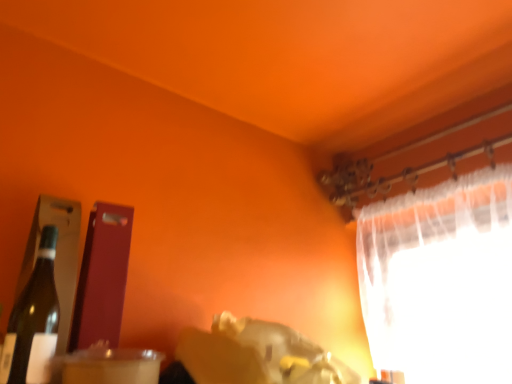
Question: Is clear plastic straw at lower left to the left of matte glass bottle at left from the viewer's perspective?

Choices:
 (A) yes
 (B) no

Answer: (B)

Question: Is clear plastic straw at lower left to the right of matte glass bottle at left from the viewer's perspective?

Choices:
 (A) no
 (B) yes

Answer: (B)

Question: Is matte glass bottle at left inside clear plastic straw at lower left?

Choices:
 (A) yes
 (B) no

Answer: (B)

Question: From the image's perspective, is clear plastic straw at lower left located above matte glass bottle at left?

Choices:
 (A) yes
 (B) no

Answer: (B)

Question: Is clear plastic straw at lower left bigger than matte glass bottle at left?

Choices:
 (A) yes
 (B) no

Answer: (B)

Question: In the image, is white sheer curtain at upper right on the left side or the right side of matte glass bottle at left?

Choices:
 (A) right
 (B) left

Answer: (A)

Question: In terms of size, does white sheer curtain at upper right appear bigger or smaller than matte glass bottle at left?

Choices:
 (A) big
 (B) small

Answer: (A)

Question: From the image's perspective, is white sheer curtain at upper right above or below matte glass bottle at left?

Choices:
 (A) below
 (B) above

Answer: (A)

Question: Is white sheer curtain at upper right taller or shorter than matte glass bottle at left?

Choices:
 (A) tall
 (B) short

Answer: (A)

Question: Which is correct: clear plastic straw at lower left is inside matte glass bottle at left, or outside of it?

Choices:
 (A) inside
 (B) outside

Answer: (B)

Question: From the image's perspective, is clear plastic straw at lower left above or below matte glass bottle at left?

Choices:
 (A) above
 (B) below

Answer: (B)

Question: Is point (76, 365) positioned closer to the camera than point (34, 334)?

Choices:
 (A) closer
 (B) farther

Answer: (A)

Question: Considering their positions, is clear plastic straw at lower left located in front of or behind matte glass bottle at left?

Choices:
 (A) behind
 (B) front

Answer: (B)

Question: Is clear plastic straw at lower left spatially inside white sheer curtain at upper right, or outside of it?

Choices:
 (A) outside
 (B) inside

Answer: (A)

Question: Is clear plastic straw at lower left wider or thinner than white sheer curtain at upper right?

Choices:
 (A) wide
 (B) thin

Answer: (B)